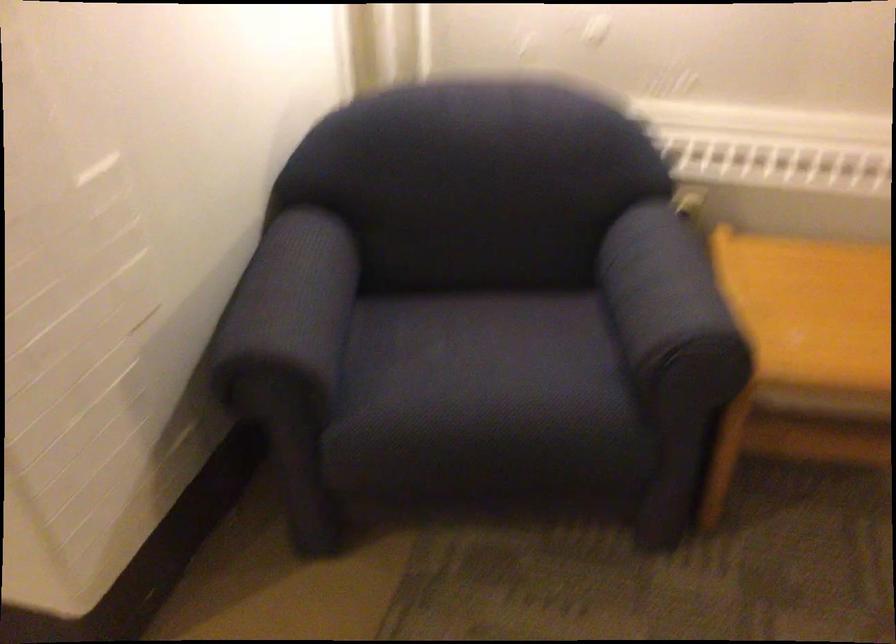
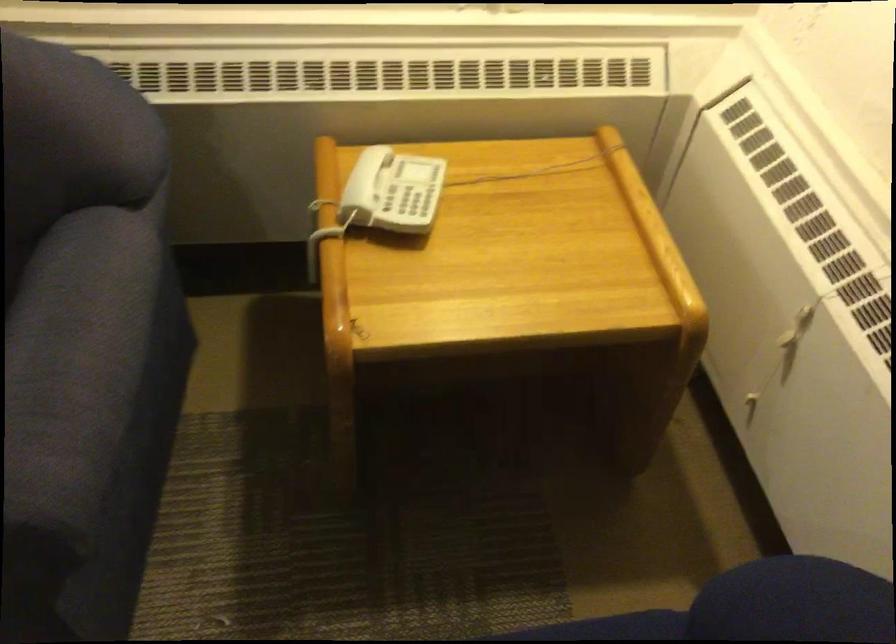
Question: In a continuous first-person perspective shot, in which direction is the camera moving?

Choices:
 (A) Left
 (B) Right
 (C) Forward
 (D) Backward

Answer: (B)